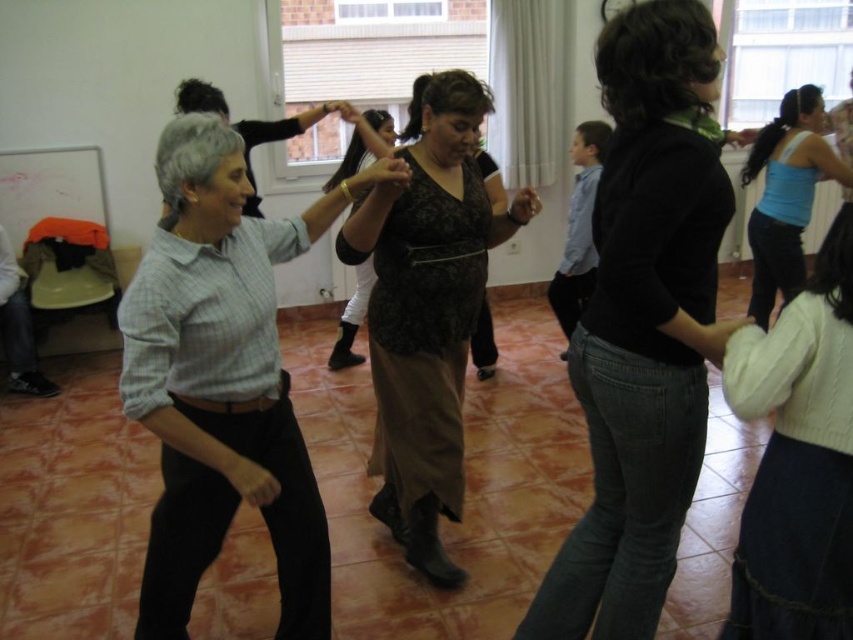
Question: Which object is the farthest from the white knit sweater at lower right?

Choices:
 (A) matte black dress at center
 (B) black lace blouse at center
 (C) black sweater at center

Answer: (A)

Question: Can you confirm if light blue plaid shirt at center is positioned to the right of white knit sweater at lower right?

Choices:
 (A) yes
 (B) no

Answer: (B)

Question: Does black lace blouse at center appear over white knit sweater at lower right?

Choices:
 (A) no
 (B) yes

Answer: (B)

Question: Considering the real-world distances, which object is closest to the matte black dress at center?

Choices:
 (A) matte blue tank top at right
 (B) light blue plaid shirt at center

Answer: (B)

Question: Which point is farther to the camera?

Choices:
 (A) (637, 200)
 (B) (834, 168)
 (C) (839, 250)
 (D) (457, 490)

Answer: (B)

Question: Is black sweater at center behind matte blue tank top at right?

Choices:
 (A) yes
 (B) no

Answer: (B)